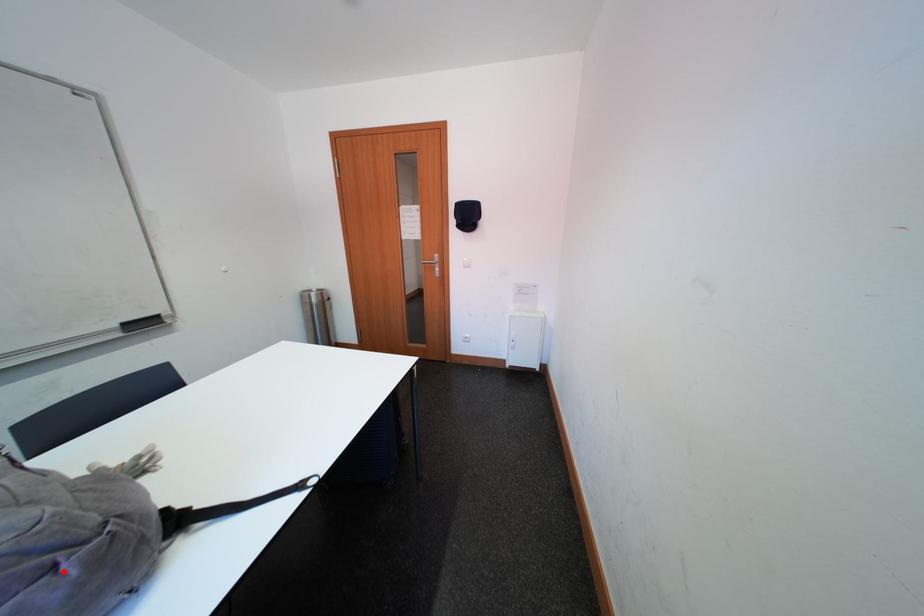
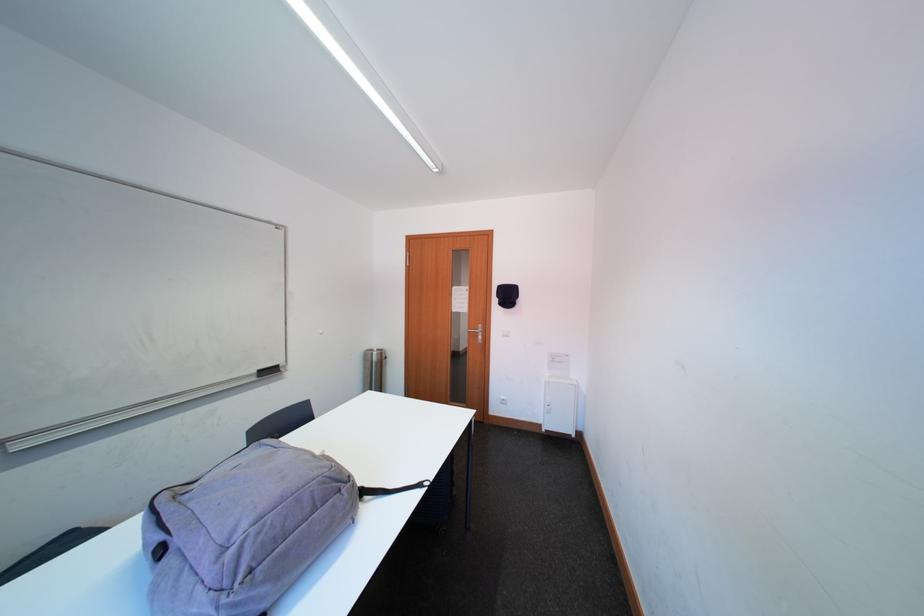
Question: I am providing you with two images of the same scene from different viewpoints. Image1 has a red point marked. In image2, the corresponding 3D location appears at what relative position? Reply with the corresponding letter.

Choices:
 (A) Closer
 (B) Farther

Answer: (A)